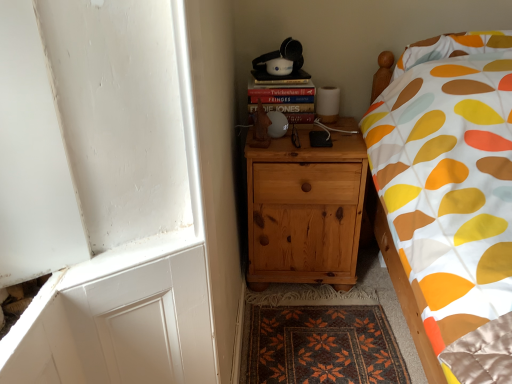
The height and width of the screenshot is (384, 512). Identify the location of blank space above natural wood nightstand at center (from a real-world perspective). pyautogui.click(x=312, y=143).